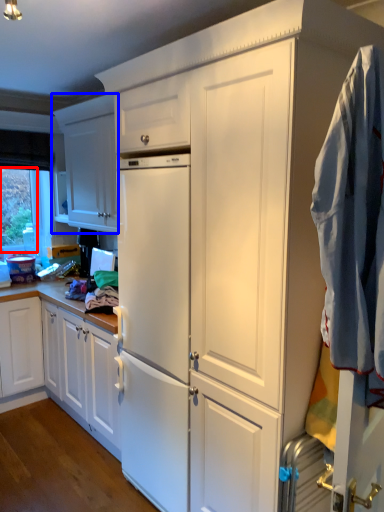
Question: Which of the following is the farthest to the observer, window screen (highlighted by a red box) or cabinetry (highlighted by a blue box)?

Choices:
 (A) window screen
 (B) cabinetry

Answer: (A)